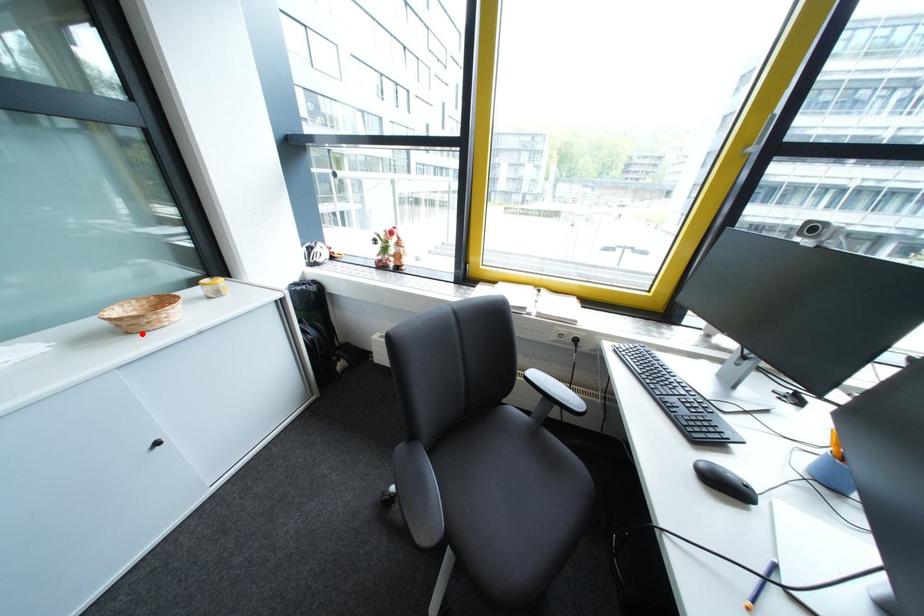
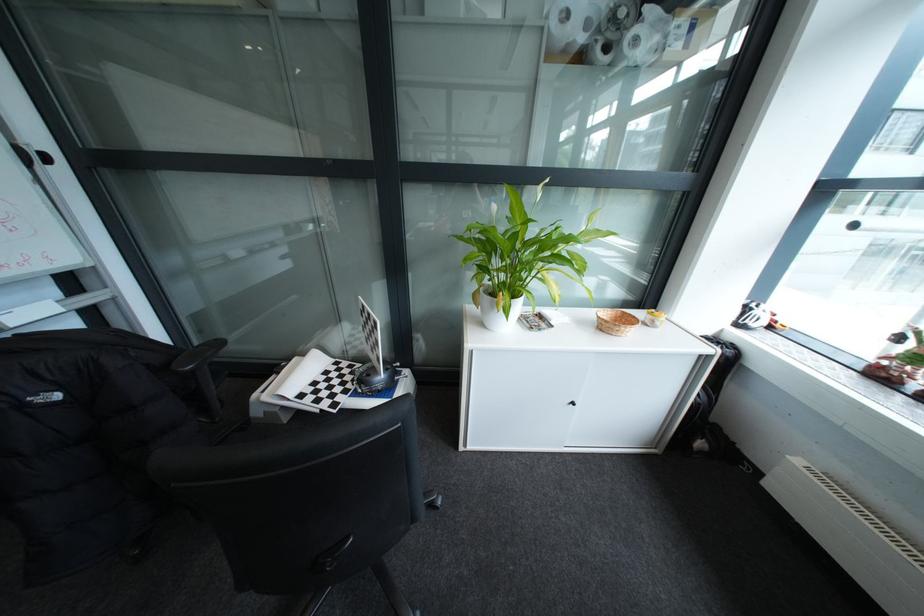
Find the pixel in the second image that matches the highlighted location in the first image.

(614, 331)